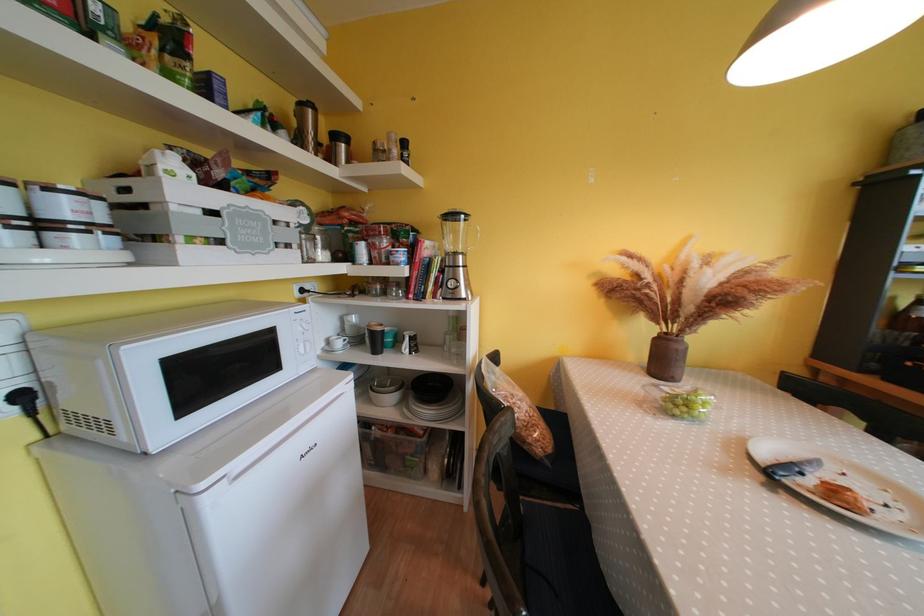
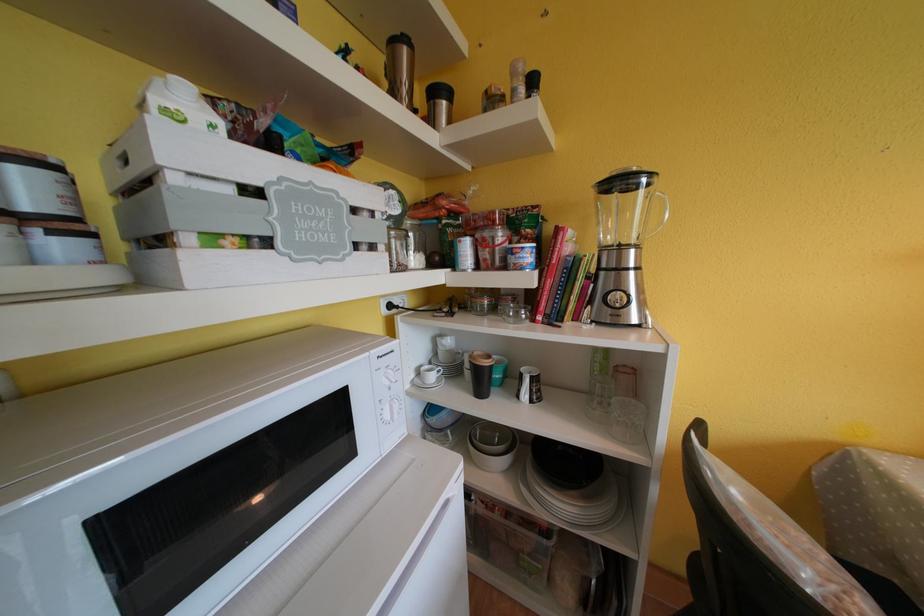
Find the pixel in the second image that matches [309,355] in the first image.

(394, 421)